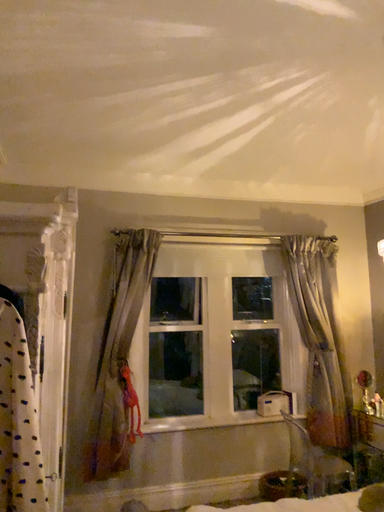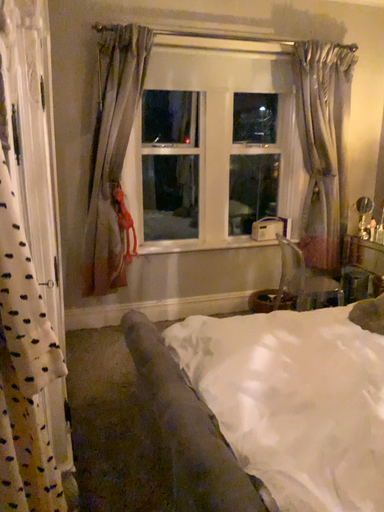
Question: Which way did the camera rotate in the video?

Choices:
 (A) rotated downward
 (B) rotated upward

Answer: (A)